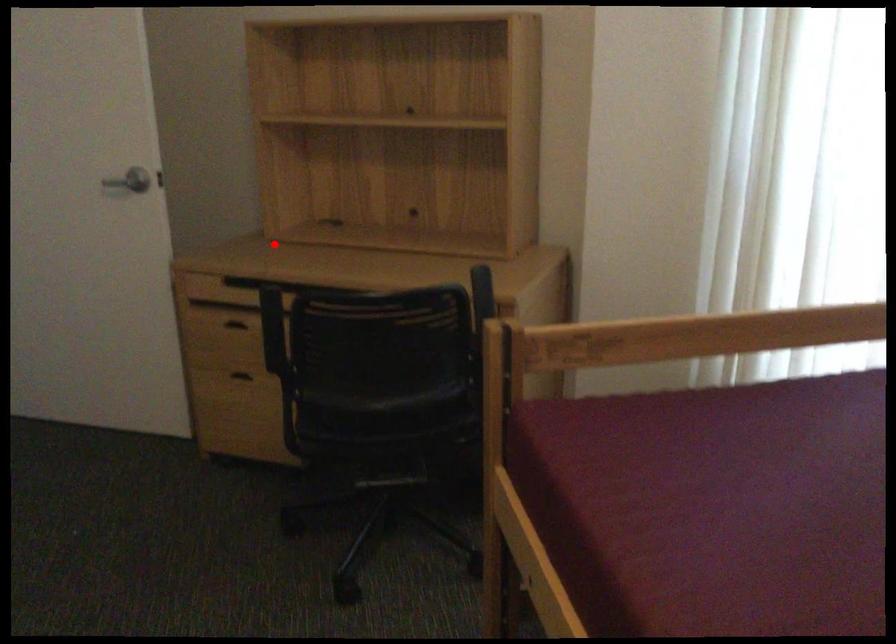
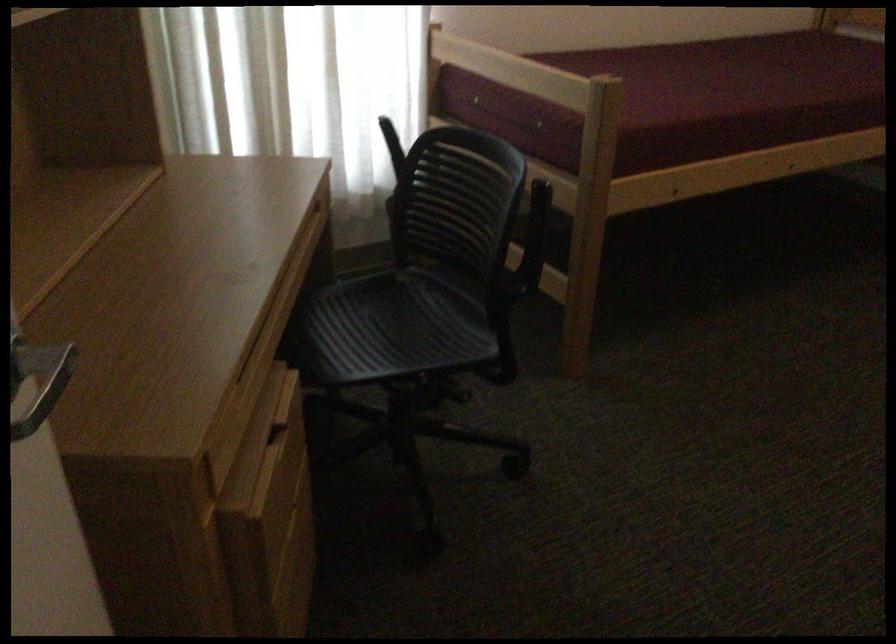
Question: I am providing you with two images of the same scene from different viewpoints. In image1, a red point is highlighted. Considering the same 3D point in image2, which of the following is correct?

Choices:
 (A) It is closer
 (B) It is farther

Answer: (A)